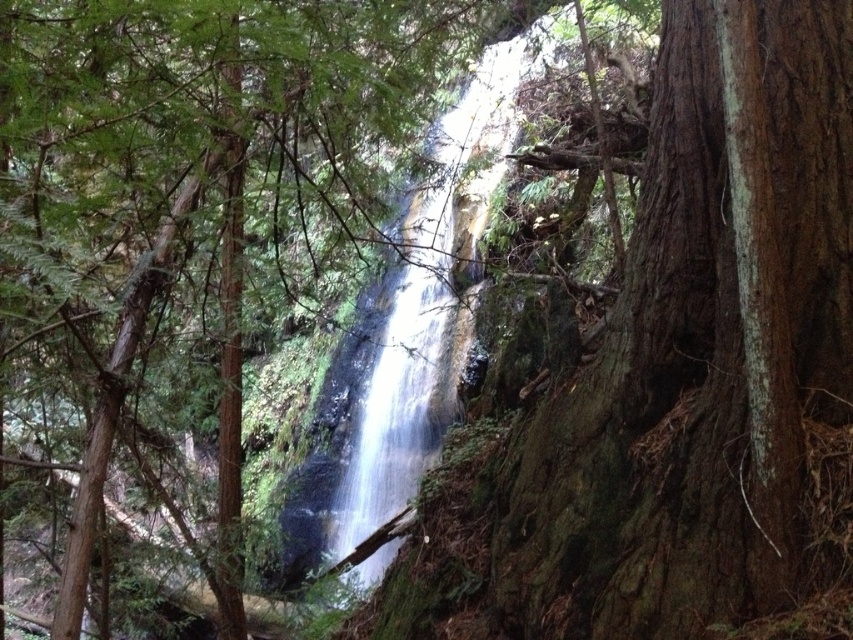
You are an artist planning to paint the waterfall and the tree in the forest scene. Since you want to emphasize the waterfall, should you paint the white smooth waterfall at center larger or smaller than the green rough bark tree at center?

The white smooth waterfall at center is smaller than the green rough bark tree at center. To emphasize the waterfall, you should paint it larger than the green rough bark tree at center.

You are a hiker standing at the edge of the forest. You see the white smooth waterfall at center. Based on the coordinates provided, can you determine if the waterfall is positioned exactly in the center of the image?

The white smooth waterfall at center is located at point (428, 307), which is very close to the center coordinates of an image, typically at (426, 320). Therefore, it can be considered positioned exactly in the center of the image.